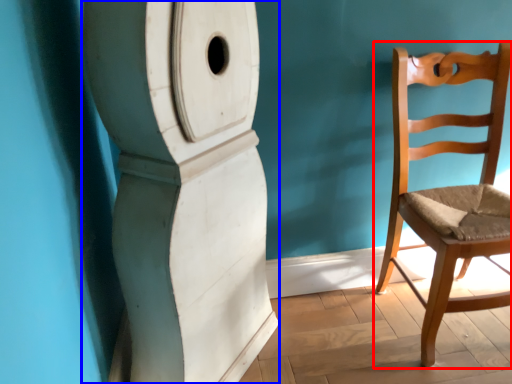
Question: Which of the following is the closest to the observer, chair (highlighted by a red box) or pillar (highlighted by a blue box)?

Choices:
 (A) chair
 (B) pillar

Answer: (B)